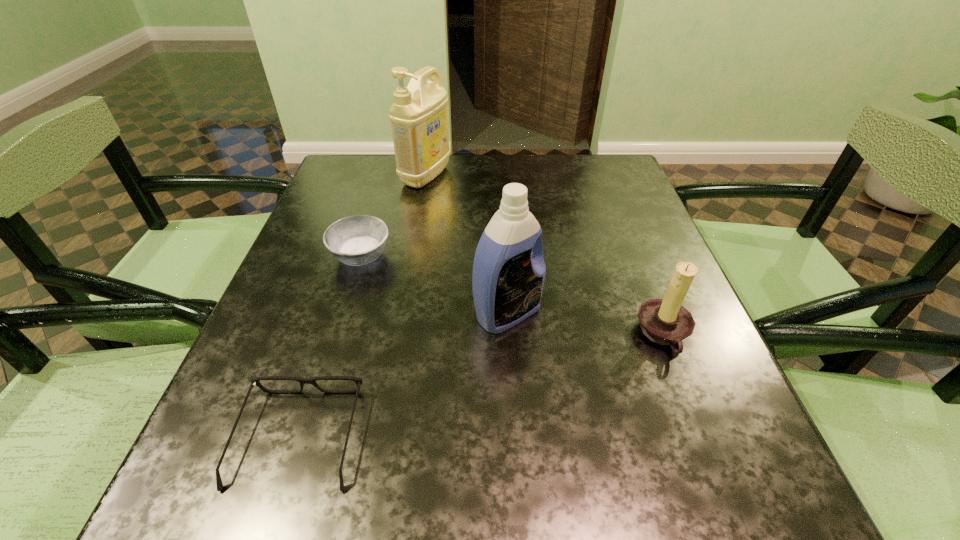
Locate an element on the screen. The width and height of the screenshot is (960, 540). object that is at the near edge is located at coordinates (255, 381).

This screenshot has height=540, width=960. In order to click on ashtray positioned at the left edge in this screenshot , I will do `click(357, 240)`.

Where is `spectacles located in the left edge section of the desktop`? The height and width of the screenshot is (540, 960). spectacles located in the left edge section of the desktop is located at coordinates (255, 381).

Where is `object located at the right edge`? The height and width of the screenshot is (540, 960). object located at the right edge is located at coordinates (665, 321).

Find the location of `object positioned at the near left corner`. object positioned at the near left corner is located at coordinates (255, 381).

The width and height of the screenshot is (960, 540). In the image, there is a desktop. In order to click on free space at the far edge in this screenshot , I will do `click(535, 188)`.

This screenshot has height=540, width=960. Find the location of `vacant space at the near edge of the desktop`. vacant space at the near edge of the desktop is located at coordinates (555, 463).

Where is `free space at the left edge`? Image resolution: width=960 pixels, height=540 pixels. free space at the left edge is located at coordinates 333,293.

You are a GUI agent. You are given a task and a screenshot of the screen. Output one action in this format:
    pyautogui.click(x=<x>, y=<y>)
    Task: Click on the vacant space at the right edge of the desktop
    Image resolution: width=960 pixels, height=540 pixels.
    Given the screenshot: What is the action you would take?
    pyautogui.click(x=658, y=246)

In the image, there is a desktop. Identify the location of free space at the far left corner. (393, 163).